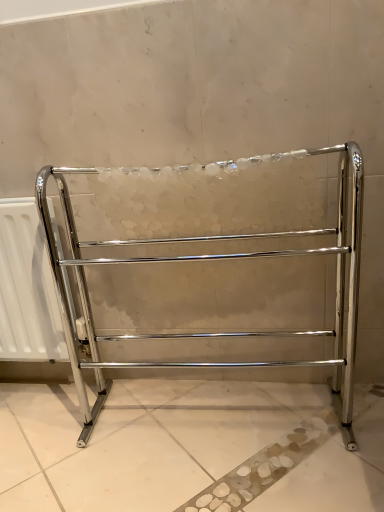
Question: Can you confirm if white matte radiator at left is positioned to the right of polished chrome towel rack at center?

Choices:
 (A) no
 (B) yes

Answer: (A)

Question: Considering the relative sizes of white matte radiator at left and polished chrome towel rack at center in the image provided, is white matte radiator at left bigger than polished chrome towel rack at center?

Choices:
 (A) yes
 (B) no

Answer: (B)

Question: Is the position of white matte radiator at left more distant than that of polished chrome towel rack at center?

Choices:
 (A) no
 (B) yes

Answer: (B)

Question: Are white matte radiator at left and polished chrome towel rack at center located far from each other?

Choices:
 (A) no
 (B) yes

Answer: (A)

Question: Is white matte radiator at left oriented towards polished chrome towel rack at center?

Choices:
 (A) no
 (B) yes

Answer: (A)

Question: Considering the relative sizes of white matte radiator at left and polished chrome towel rack at center in the image provided, is white matte radiator at left thinner than polished chrome towel rack at center?

Choices:
 (A) yes
 (B) no

Answer: (A)

Question: Is polished chrome towel rack at center at the right side of white matte radiator at left?

Choices:
 (A) no
 (B) yes

Answer: (B)

Question: Is polished chrome towel rack at center touching white matte radiator at left?

Choices:
 (A) no
 (B) yes

Answer: (A)

Question: Is polished chrome towel rack at center far away from white matte radiator at left?

Choices:
 (A) no
 (B) yes

Answer: (A)

Question: Does polished chrome towel rack at center have a lesser width compared to white matte radiator at left?

Choices:
 (A) no
 (B) yes

Answer: (A)

Question: Is polished chrome towel rack at center shorter than white matte radiator at left?

Choices:
 (A) no
 (B) yes

Answer: (A)

Question: From the image's perspective, is polished chrome towel rack at center located beneath white matte radiator at left?

Choices:
 (A) no
 (B) yes

Answer: (A)

Question: From a real-world perspective, is polished chrome towel rack at center above or below white matte radiator at left?

Choices:
 (A) below
 (B) above

Answer: (B)